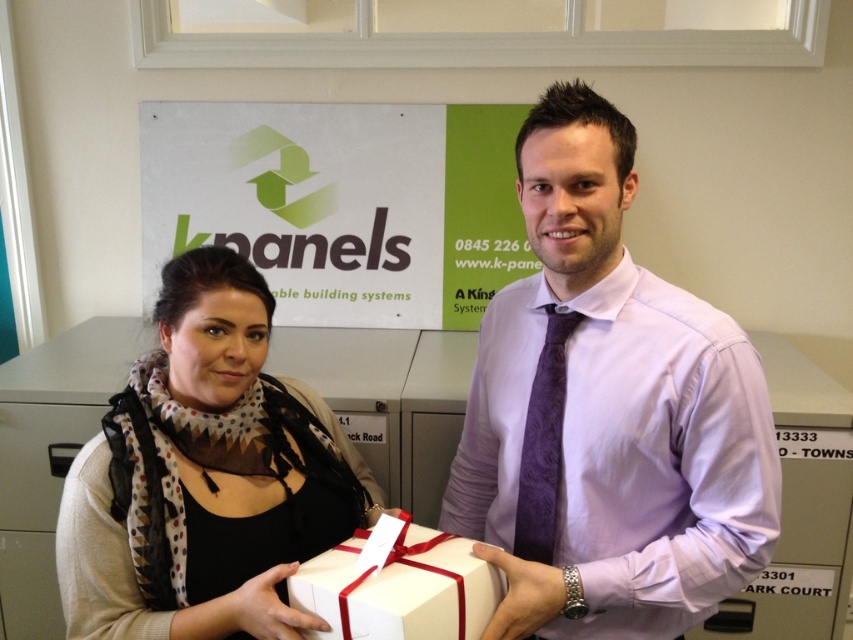
Who is more distant from viewer, (486, 378) or (523, 237)?

Point (523, 237)

Can you confirm if purple satin shirt at center is smaller than green matte signboard at upper center?

Indeed, purple satin shirt at center has a smaller size compared to green matte signboard at upper center.

Does point (650, 300) lie behind point (345, 232)?

No.

I want to click on purple satin shirt at center, so click(x=607, y=413).

Is purple satin shirt at center taller than white matte gift box at center?

Correct, purple satin shirt at center is much taller as white matte gift box at center.

Which is more to the left, purple satin shirt at center or white matte gift box at center?

white matte gift box at center is more to the left.

Where is `purple satin shirt at center`? purple satin shirt at center is located at coordinates (607, 413).

Identify the location of purple satin shirt at center. (607, 413).

Is purple satin shirt at center wider than black scarf at center?

No, purple satin shirt at center is not wider than black scarf at center.

Who is positioned more to the left, purple satin shirt at center or black scarf at center?

From the viewer's perspective, black scarf at center appears more on the left side.

Is point (587, 605) farther from viewer compared to point (236, 536)?

No, it is not.

This screenshot has width=853, height=640. What are the coordinates of `purple satin shirt at center` in the screenshot? It's located at (607, 413).